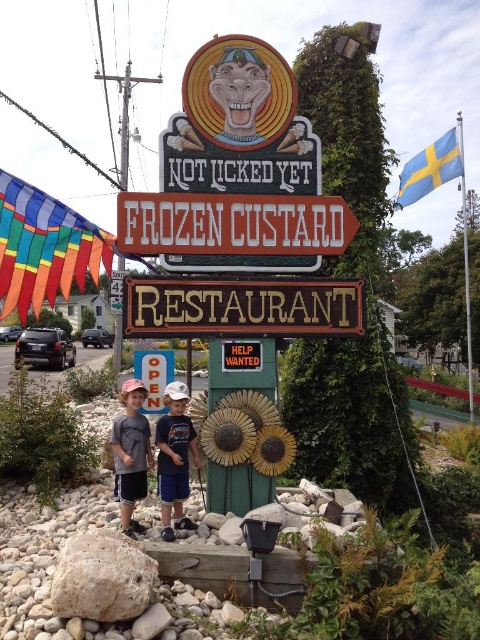
Question: Is white painted wood signboard at center wider than gray cotton shirt at lower center?

Choices:
 (A) no
 (B) yes

Answer: (B)

Question: Is white painted wood signboard at center further to camera compared to blue denim shorts at center?

Choices:
 (A) yes
 (B) no

Answer: (A)

Question: Which object is positioned closest to the light blue denim shorts at center?

Choices:
 (A) brown wooden sign at center
 (B) gray cotton shirt at lower center

Answer: (B)

Question: Which of the following is the farthest from the observer?

Choices:
 (A) (340, 291)
 (B) (191, 444)
 (C) (130, 442)
 (D) (130, 202)

Answer: (A)

Question: Which object is farther from the camera taking this photo?

Choices:
 (A) white painted wood signboard at center
 (B) blue denim shorts at center
 (C) gray cotton shirt at lower center

Answer: (A)

Question: Does brown wooden sign at center appear on the right side of light blue denim shorts at center?

Choices:
 (A) yes
 (B) no

Answer: (A)